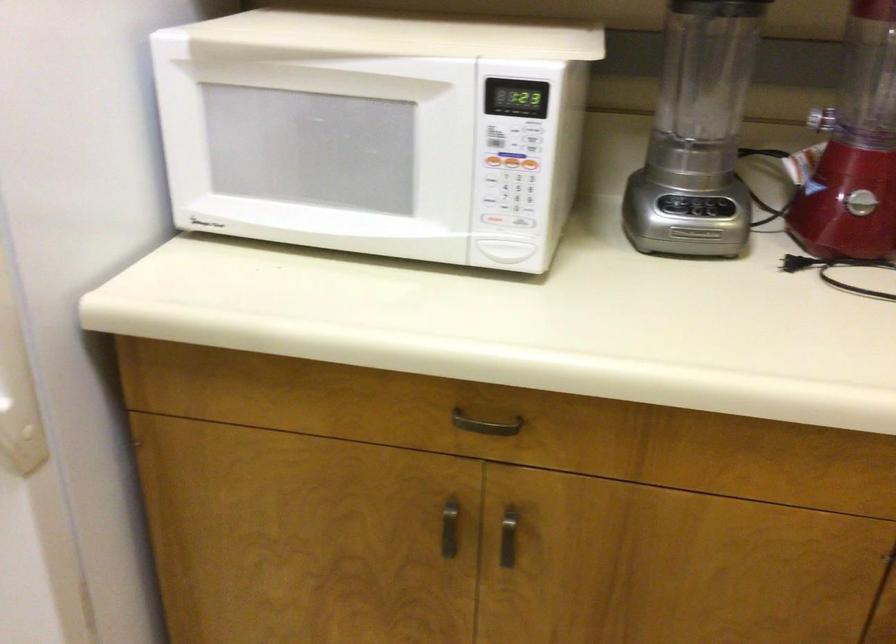
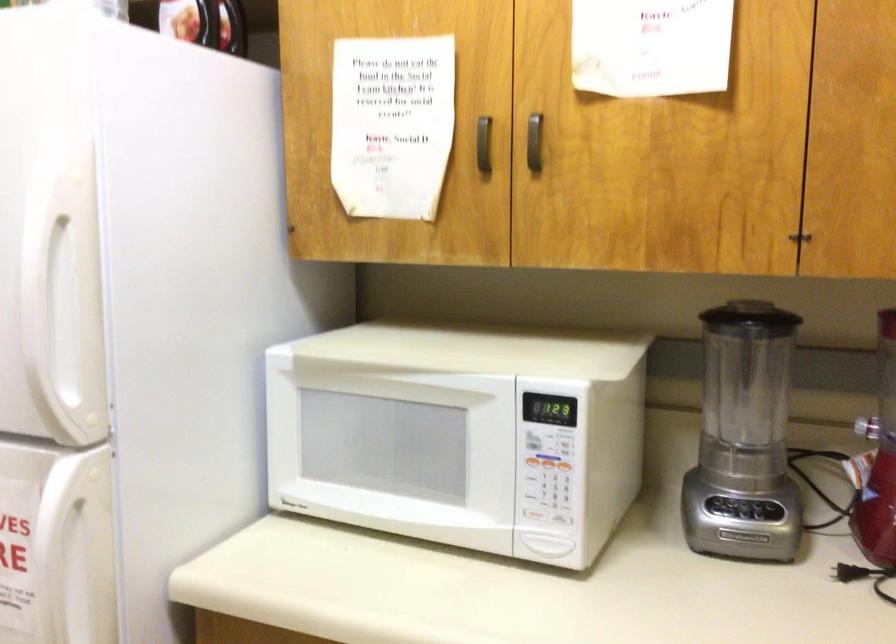
In the second image, find the point that corresponds to pixel 489 216 in the first image.

(533, 515)